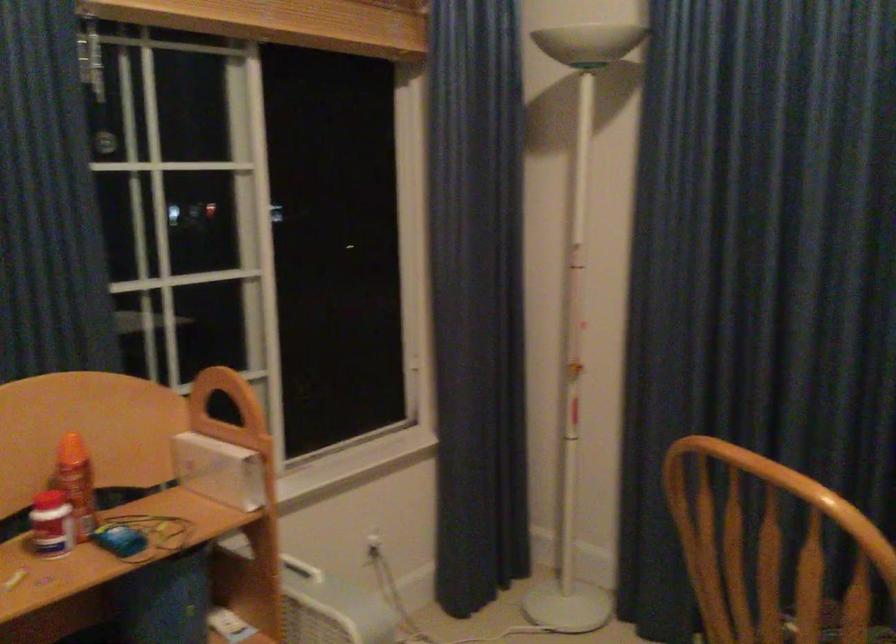
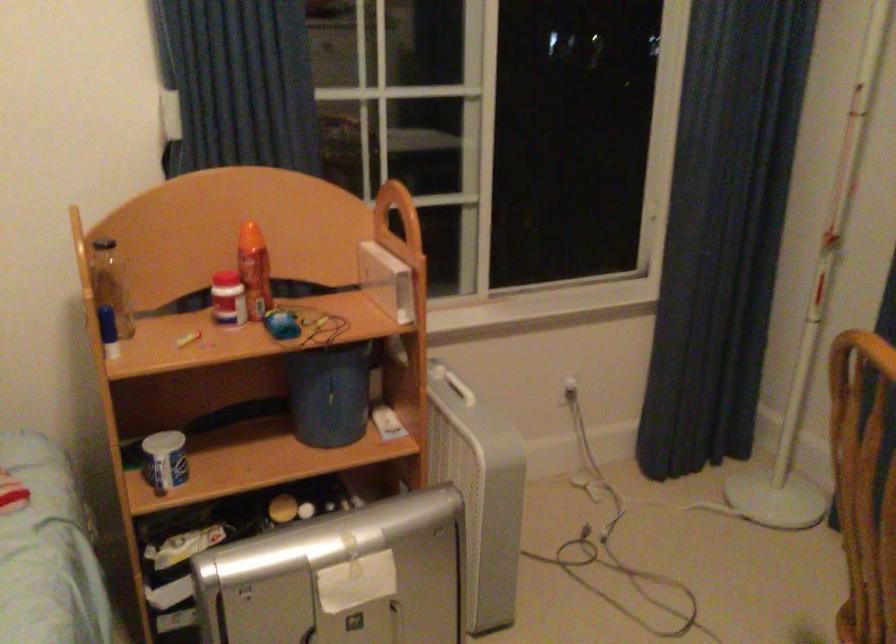
In the second image, find the point that corresponds to pixel 85 478 in the first image.

(254, 270)